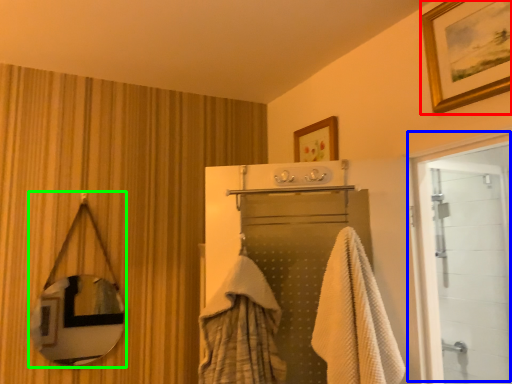
Question: Estimate the real-world distances between objects in this image. Which object is closer to picture frame (highlighted by a red box), door (highlighted by a blue box) or mirror (highlighted by a green box)?

Choices:
 (A) door
 (B) mirror

Answer: (A)